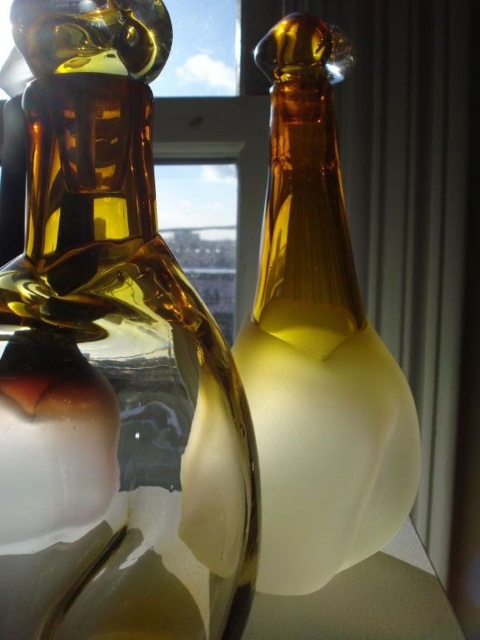
Who is more distant from viewer, (x=283, y=392) or (x=448, y=614)?

Positioned behind is point (x=448, y=614).

Does amber glass bottle at center have a greater width compared to white matte glass table at lower center?

No, amber glass bottle at center is not wider than white matte glass table at lower center.

Measure the distance between amber glass bottle at center and camera.

7.12 inches

The image size is (480, 640). Find the location of `amber glass bottle at center`. amber glass bottle at center is located at coordinates (317, 342).

Does amber glass vase at left have a smaller size compared to white matte glass table at lower center?

No.

Is the position of amber glass vase at left more distant than that of white matte glass table at lower center?

That is False.

You are a GUI agent. You are given a task and a screenshot of the screen. Output one action in this format:
    pyautogui.click(x=<x>, y=<y>)
    Task: Click on the amber glass vase at left
    The width and height of the screenshot is (480, 640).
    Given the screenshot: What is the action you would take?
    coord(127,344)

Image resolution: width=480 pixels, height=640 pixels. I want to click on amber glass vase at left, so click(127, 344).

Between amber glass vase at left and amber glass bottle at center, which one has more height?

amber glass bottle at center

Does amber glass vase at left have a lesser height compared to amber glass bottle at center?

Yes.

Between point (214, 497) and point (408, 474), which one is positioned behind?

Positioned behind is point (408, 474).

Identify the location of amber glass vase at left. The image size is (480, 640). (127, 344).